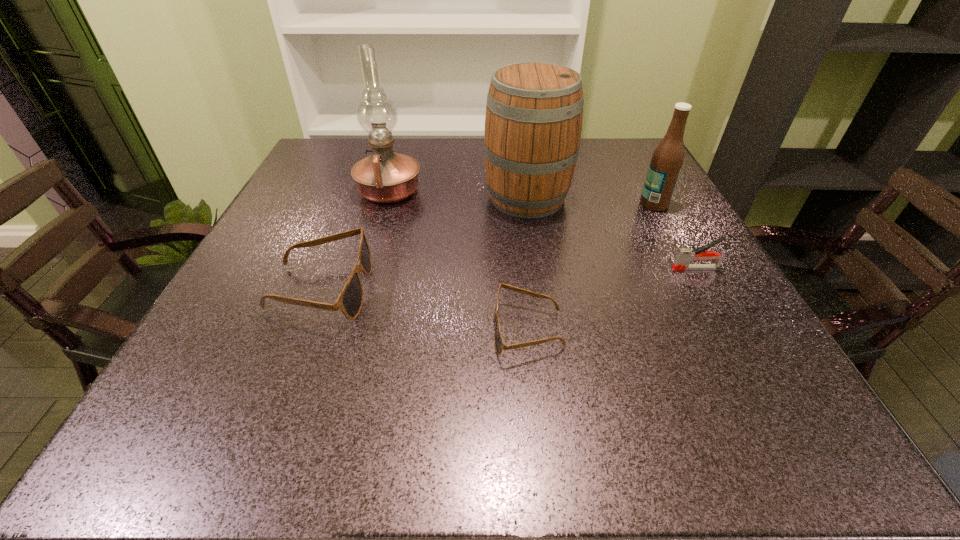
Considering the uniform spacing of sunglassess, where should an additional sunglasses be positioned on the right? Please locate a free spot. Please provide its 2D coordinates. Your answer should be formatted as a tuple, i.e. [(x, y)], where the tuple contains the x and y coordinates of a point satisfying the conditions above.

[(780, 380)]